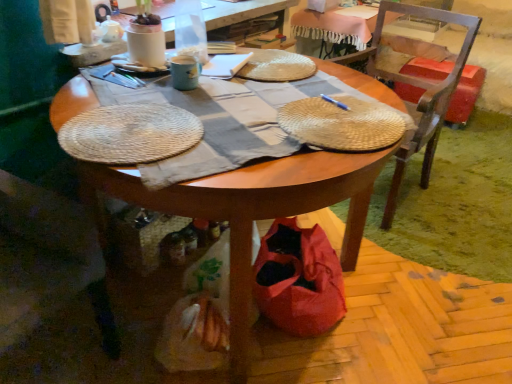
Question: Should I look upward or downward to see wooden table at center?

Choices:
 (A) up
 (B) down

Answer: (A)

Question: Is translucent plastic bottle at upper center surrounded by red plastic trash can at right?

Choices:
 (A) yes
 (B) no

Answer: (B)

Question: Is red plastic trash can at right oriented away from translucent plastic bottle at upper center?

Choices:
 (A) no
 (B) yes

Answer: (A)

Question: Would you say red plastic trash can at right is a long distance from translucent plastic bottle at upper center?

Choices:
 (A) yes
 (B) no

Answer: (A)

Question: Is red plastic trash can at right aimed at translucent plastic bottle at upper center?

Choices:
 (A) no
 (B) yes

Answer: (B)

Question: Can you confirm if red plastic trash can at right is bigger than translucent plastic bottle at upper center?

Choices:
 (A) yes
 (B) no

Answer: (A)

Question: Would you say red plastic trash can at right is outside translucent plastic bottle at upper center?

Choices:
 (A) yes
 (B) no

Answer: (A)

Question: Can you see blue metallic pen at center touching wooden chair at right, the 2th chair in the front-to-back sequence?

Choices:
 (A) no
 (B) yes

Answer: (A)

Question: Considering the relative sizes of blue metallic pen at center and wooden chair at right, marked as the first chair in a right-to-left arrangement, in the image provided, is blue metallic pen at center wider than wooden chair at right, marked as the first chair in a right-to-left arrangement,?

Choices:
 (A) yes
 (B) no

Answer: (B)

Question: Is blue metallic pen at center to the right of wooden chair at right, placed as the first chair when sorted from back to front, from the viewer's perspective?

Choices:
 (A) no
 (B) yes

Answer: (A)

Question: Considering the relative sizes of blue metallic pen at center and wooden chair at right, placed as the first chair when sorted from back to front, in the image provided, is blue metallic pen at center taller than wooden chair at right, placed as the first chair when sorted from back to front,?

Choices:
 (A) yes
 (B) no

Answer: (B)

Question: From the image's perspective, is blue metallic pen at center on wooden chair at right, the second chair viewed from the left?

Choices:
 (A) no
 (B) yes

Answer: (A)

Question: From the image's perspective, does blue metallic pen at center appear lower than wooden chair at right, placed as the first chair when sorted from back to front?

Choices:
 (A) yes
 (B) no

Answer: (A)

Question: Can you confirm if translucent plastic bottle at upper center is shorter than matte ceramic mug at upper center?

Choices:
 (A) no
 (B) yes

Answer: (A)